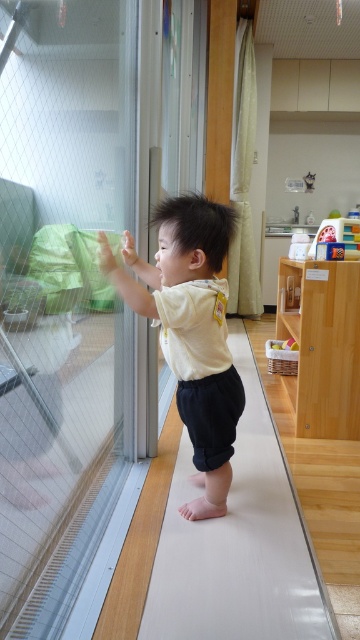
Is white cotton shirt at center shorter than plastic colorful blocks at upper right?

Incorrect, white cotton shirt at center's height does not fall short of plastic colorful blocks at upper right's.

Is white cotton shirt at center positioned before plastic colorful blocks at upper right?

Yes, it is in front of plastic colorful blocks at upper right.

What are the coordinates of `white cotton shirt at center` in the screenshot? It's located at (191, 330).

Between transparent glass door at left and white cotton shirt at center, which one appears on the right side from the viewer's perspective?

white cotton shirt at center

Is transparent glass door at left smaller than white cotton shirt at center?

No.

Where is `transparent glass door at left`? This screenshot has width=360, height=640. transparent glass door at left is located at coordinates (61, 296).

You are a GUI agent. You are given a task and a screenshot of the screen. Output one action in this format:
    pyautogui.click(x=<x>, y=<y>)
    Task: Click on the transparent glass door at left
    The height and width of the screenshot is (640, 360).
    Given the screenshot: What is the action you would take?
    pyautogui.click(x=61, y=296)

Who is shorter, white smooth ramp at center or plastic colorful blocks at upper right?

plastic colorful blocks at upper right

What do you see at coordinates (239, 544) in the screenshot? I see `white smooth ramp at center` at bounding box center [239, 544].

Locate an element on the screen. white smooth ramp at center is located at coordinates (239, 544).